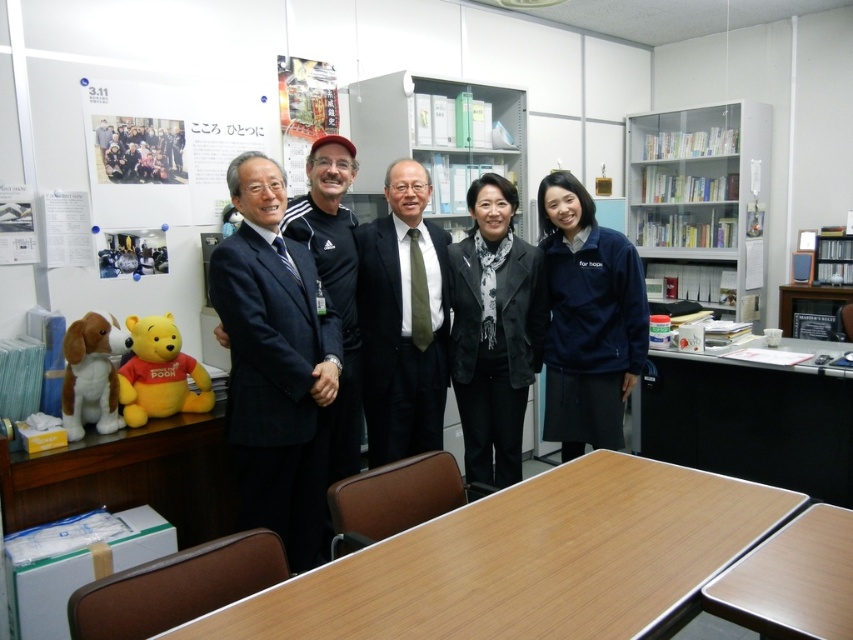
Which is more to the left, wooden table at lower right or dark green textured tie at center?

dark green textured tie at center is more to the left.

Which is in front, point (697, 432) or point (418, 396)?

Point (418, 396)

Does point (752, 369) lie in front of point (393, 189)?

No, it is behind (393, 189).

Image resolution: width=853 pixels, height=640 pixels. What are the coordinates of `wooden table at lower right` in the screenshot? It's located at (747, 420).

Does wooden table at center appear on the right side of white glass bookshelf at upper right?

Incorrect, wooden table at center is not on the right side of white glass bookshelf at upper right.

Which of these two, wooden table at center or white glass bookshelf at upper right, stands shorter?

Standing shorter between the two is wooden table at center.

Is point (602, 492) farther from viewer compared to point (711, 228)?

No, (602, 492) is in front of (711, 228).

Where is `wooden table at center`? wooden table at center is located at coordinates (529, 563).

Between metallic gray bookshelf at upper center and brown laminate table at lower right, which one has less height?

Standing shorter between the two is brown laminate table at lower right.

Who is taller, metallic gray bookshelf at upper center or brown laminate table at lower right?

metallic gray bookshelf at upper center is taller.

Who is more forward, (424, 109) or (837, 584)?

Point (837, 584) is in front.

You are a GUI agent. You are given a task and a screenshot of the screen. Output one action in this format:
    pyautogui.click(x=<x>, y=<y>)
    Task: Click on the metallic gray bookshelf at upper center
    This screenshot has height=640, width=853.
    Given the screenshot: What is the action you would take?
    pyautogui.click(x=432, y=140)